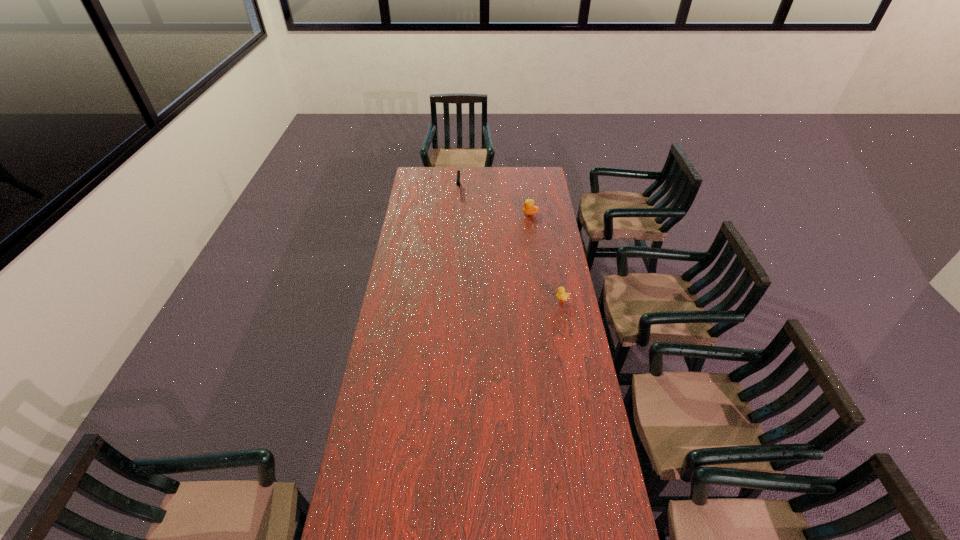
This screenshot has height=540, width=960. Find the location of `vacant point located between the farthest object and the left duckling`. vacant point located between the farthest object and the left duckling is located at coordinates (x=494, y=201).

This screenshot has width=960, height=540. Find the location of `free spot between the second object from left to right and the pistol`. free spot between the second object from left to right and the pistol is located at coordinates (494, 201).

You are a GUI agent. You are given a task and a screenshot of the screen. Output one action in this format:
    pyautogui.click(x=<x>, y=<y>)
    Task: Click on the free space between the nearer duckling and the farthest object
    The height and width of the screenshot is (540, 960).
    Given the screenshot: What is the action you would take?
    pyautogui.click(x=510, y=245)

I want to click on the second closest object to the leftmost object, so click(561, 295).

Choose which object is the second nearest neighbor to the second object from right to left. Please provide its 2D coordinates. Your answer should be formatted as a tuple, i.e. [(x, y)], where the tuple contains the x and y coordinates of a point satisfying the conditions above.

[(561, 295)]